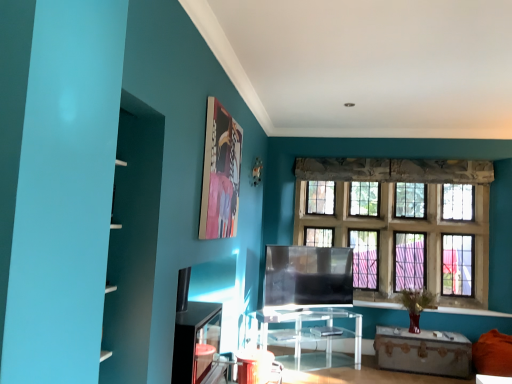
Question: Does matte blue bookshelf at left have a greater height compared to clear glass windows at center?

Choices:
 (A) no
 (B) yes

Answer: (A)

Question: Is matte blue bookshelf at left oriented towards clear glass windows at center?

Choices:
 (A) yes
 (B) no

Answer: (B)

Question: Considering the relative sizes of matte blue bookshelf at left and clear glass windows at center in the image provided, is matte blue bookshelf at left thinner than clear glass windows at center?

Choices:
 (A) no
 (B) yes

Answer: (A)

Question: Is matte blue bookshelf at left in front of clear glass windows at center?

Choices:
 (A) no
 (B) yes

Answer: (B)

Question: Is matte blue bookshelf at left behind clear glass windows at center?

Choices:
 (A) no
 (B) yes

Answer: (A)

Question: From a real-world perspective, is transparent acrylic table at center, the 2th table in the right-to-left sequence, positioned above or below matte plastic picture frame at upper center?

Choices:
 (A) below
 (B) above

Answer: (A)

Question: Considering the positions of transparent acrylic table at center, the first table when ordered from left to right, and matte plastic picture frame at upper center in the image, is transparent acrylic table at center, the first table when ordered from left to right, taller or shorter than matte plastic picture frame at upper center?

Choices:
 (A) short
 (B) tall

Answer: (A)

Question: Would you say transparent acrylic table at center, the 2th table in the right-to-left sequence, is inside or outside matte plastic picture frame at upper center?

Choices:
 (A) outside
 (B) inside

Answer: (A)

Question: From the image's perspective, relative to matte plastic picture frame at upper center, is transparent acrylic table at center, the 2th table in the right-to-left sequence, above or below?

Choices:
 (A) below
 (B) above

Answer: (A)

Question: Considering the positions of point (296, 350) and point (285, 266), is point (296, 350) closer or farther from the camera than point (285, 266)?

Choices:
 (A) closer
 (B) farther

Answer: (B)

Question: Is transparent acrylic table at center, the 2th table in the right-to-left sequence, bigger or smaller than transparent glass tv at center?

Choices:
 (A) small
 (B) big

Answer: (B)

Question: Considering the positions of transparent acrylic table at center, the first table when ordered from left to right, and transparent glass tv at center in the image, is transparent acrylic table at center, the first table when ordered from left to right, wider or thinner than transparent glass tv at center?

Choices:
 (A) thin
 (B) wide

Answer: (B)

Question: From a real-world perspective, relative to transparent glass tv at center, is transparent acrylic table at center, the 2th table in the right-to-left sequence, vertically above or below?

Choices:
 (A) below
 (B) above

Answer: (A)

Question: Would you say clear glass windows at center is to the left or to the right of matte blue bookshelf at left in the picture?

Choices:
 (A) right
 (B) left

Answer: (A)

Question: From a real-world perspective, relative to matte blue bookshelf at left, is clear glass windows at center vertically above or below?

Choices:
 (A) above
 (B) below

Answer: (A)